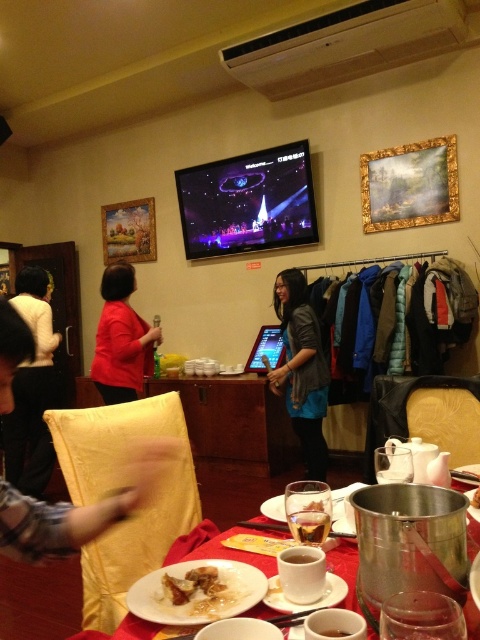
You are standing in the restaurant scene and want to reach the point marked as point (111, 253). If your walking speed is 3 feet per second, how many seconds will it take you to reach that point?

The distance between you and point (111, 253) is 18.23 feet. At a speed of 3 feet per second, it would take approximately 6.08 seconds to reach the point.